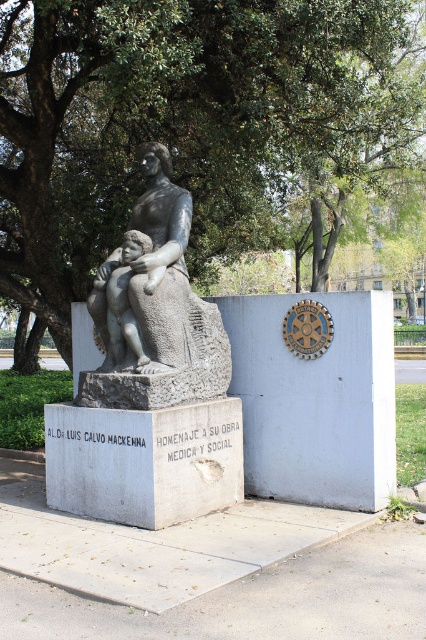
Based on the scene description, what does the point at coordinates (186, 120) on the pedestal represent?

The point at coordinates (186, 120) on the pedestal indicates the location of the green leafy tree at upper center.

You are a photographer planning to take a photo of the matte gray statue at center. You want to ensure the green leafy tree at upper center appears to the right of the statue in your composition. Is this possible based on the current arrangement?

The green leafy tree at upper center is positioned on the left side of matte gray statue at center, so to have the tree appear to the right of the statue in the photo, you would need to adjust your angle or position since the tree is currently to the left.

You are a landscape architect planning to install a new lighting system around the green leafy tree at upper center and the matte gray stone statue at center. Considering their heights, which object requires taller lighting fixtures?

The matte gray stone statue at center requires taller lighting fixtures because it is taller than the green leafy tree at upper center according to the description.